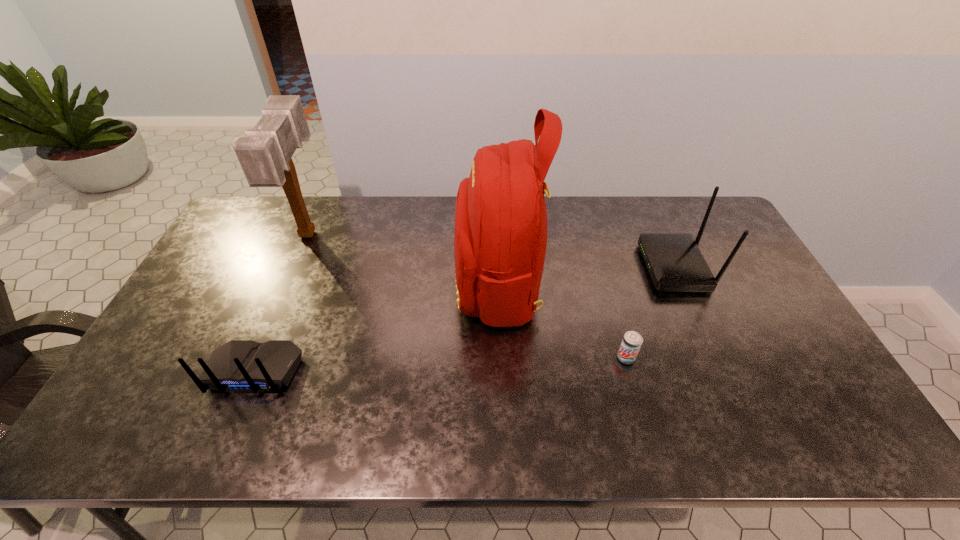
Find the location of a particular element. Image resolution: width=960 pixels, height=540 pixels. free space located 0.080m on the front-facing side of the backpack is located at coordinates (430, 282).

Where is `free space located on the front-facing side of the backpack`? Image resolution: width=960 pixels, height=540 pixels. free space located on the front-facing side of the backpack is located at coordinates (420, 282).

Image resolution: width=960 pixels, height=540 pixels. What are the coordinates of `free space located 0.050m on the front of the fourth shortest object` in the screenshot? It's located at (290, 276).

Identify the location of vacant area situated on the front-facing side of the taller router. The width and height of the screenshot is (960, 540). tap(571, 267).

This screenshot has height=540, width=960. Find the location of `free spot located on the front-facing side of the taller router`. free spot located on the front-facing side of the taller router is located at coordinates (575, 267).

You are a GUI agent. You are given a task and a screenshot of the screen. Output one action in this format:
    pyautogui.click(x=<x>, y=<y>)
    Task: Click on the free space located 0.340m on the front-facing side of the taller router
    The height and width of the screenshot is (540, 960).
    Given the screenshot: What is the action you would take?
    pyautogui.click(x=537, y=267)

Where is `vacant space located on the back of the nearer router`? vacant space located on the back of the nearer router is located at coordinates (228, 434).

Locate an element on the screen. This screenshot has width=960, height=540. vacant position located 0.110m on the right of the shortest object is located at coordinates (677, 358).

This screenshot has width=960, height=540. Find the location of `object that is at the far edge`. object that is at the far edge is located at coordinates (265, 153).

Identify the location of object located in the right edge section of the desktop. The width and height of the screenshot is (960, 540). (675, 263).